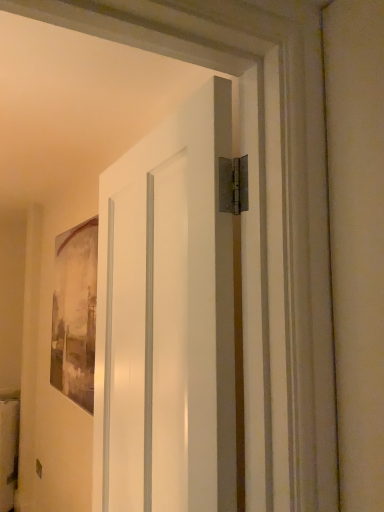
Question: From a real-world perspective, relative to white matte door at center, is matte gray painting at left vertically above or below?

Choices:
 (A) above
 (B) below

Answer: (A)

Question: From the image's perspective, is matte gray painting at left located above or below white matte door at center?

Choices:
 (A) below
 (B) above

Answer: (A)

Question: Considering the positions of matte gray painting at left and white matte door at center in the image, is matte gray painting at left wider or thinner than white matte door at center?

Choices:
 (A) wide
 (B) thin

Answer: (B)

Question: Is white matte door at center bigger or smaller than matte gray painting at left?

Choices:
 (A) small
 (B) big

Answer: (B)

Question: Is white matte door at center taller or shorter than matte gray painting at left?

Choices:
 (A) short
 (B) tall

Answer: (B)

Question: Considering the relative positions of white matte door at center and matte gray painting at left in the image provided, is white matte door at center to the left or to the right of matte gray painting at left?

Choices:
 (A) right
 (B) left

Answer: (A)

Question: Relative to matte gray painting at left, is white matte door at center in front or behind?

Choices:
 (A) front
 (B) behind

Answer: (A)